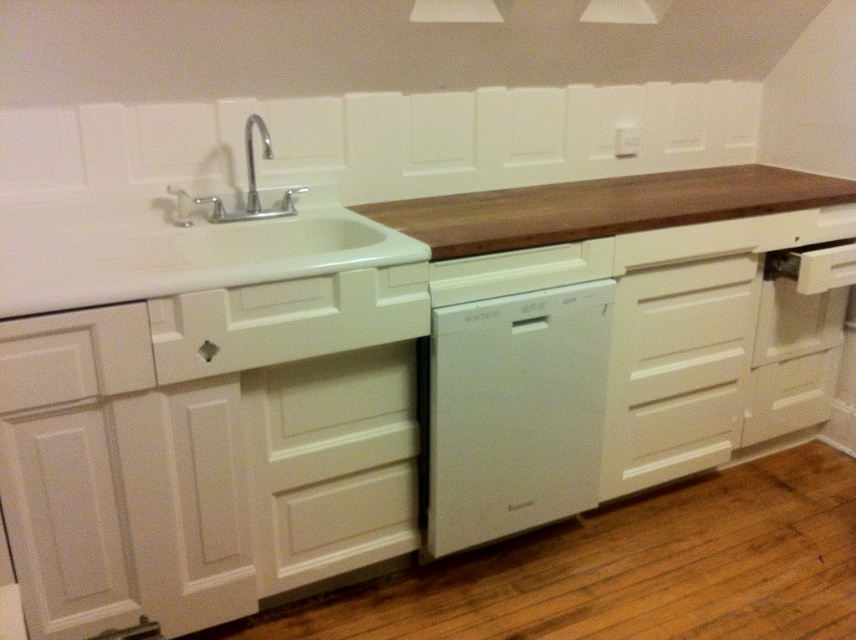
Question: Is wooden countertop at upper center below brown wood countertop at center?

Choices:
 (A) yes
 (B) no

Answer: (A)

Question: Which of these objects is positioned farthest from the white matte drawer at lower left?

Choices:
 (A) brown wood countertop at center
 (B) wooden countertop at upper center
 (C) white matte dishwasher at center

Answer: (A)

Question: Can you confirm if wooden countertop at upper center is positioned to the left of white matte drawer at lower left?

Choices:
 (A) no
 (B) yes

Answer: (A)

Question: Which object is closer to the camera taking this photo?

Choices:
 (A) white matte drawer at lower left
 (B) wooden countertop at upper center

Answer: (A)

Question: Can you confirm if white matte dishwasher at center is smaller than white wood drawer at center?

Choices:
 (A) no
 (B) yes

Answer: (A)

Question: Among these objects, which one is farthest from the camera?

Choices:
 (A) polished chrome faucet at upper left
 (B) wooden countertop at upper center

Answer: (A)